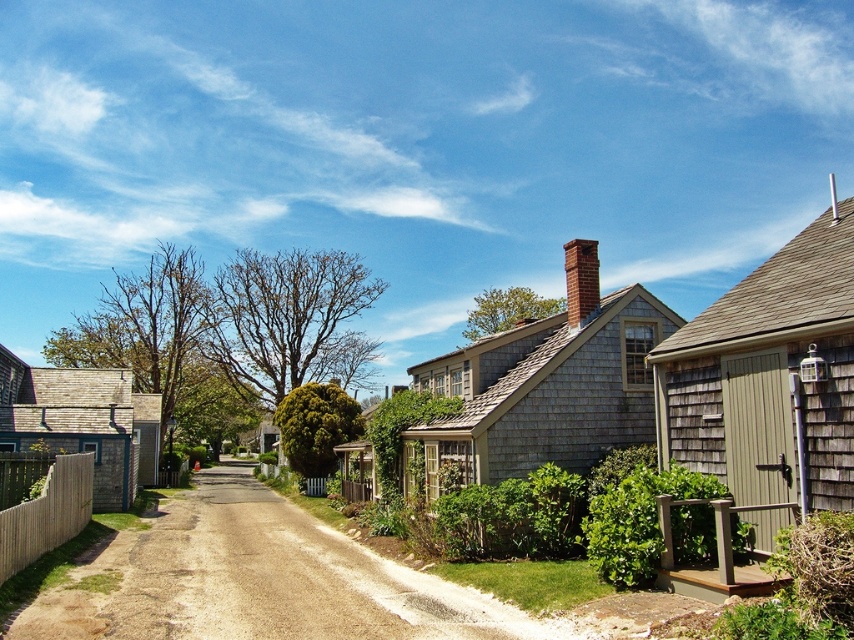
Question: Which of the following is the closest to the observer?

Choices:
 (A) wooden picket fence at lower left
 (B) brick chimney at upper center

Answer: (A)

Question: Is wooden picket fence at lower left wider than brick chimney at upper center?

Choices:
 (A) no
 (B) yes

Answer: (B)

Question: Can you confirm if wooden picket fence at lower left is smaller than brick chimney at upper center?

Choices:
 (A) no
 (B) yes

Answer: (A)

Question: Which object is closer to the camera taking this photo?

Choices:
 (A) brick chimney at upper center
 (B) wooden picket fence at lower left

Answer: (B)

Question: Which object is closer to the camera taking this photo?

Choices:
 (A) wooden picket fence at lower left
 (B) brick chimney at upper center

Answer: (A)

Question: Is wooden picket fence at lower left positioned in front of brick chimney at upper center?

Choices:
 (A) yes
 (B) no

Answer: (A)